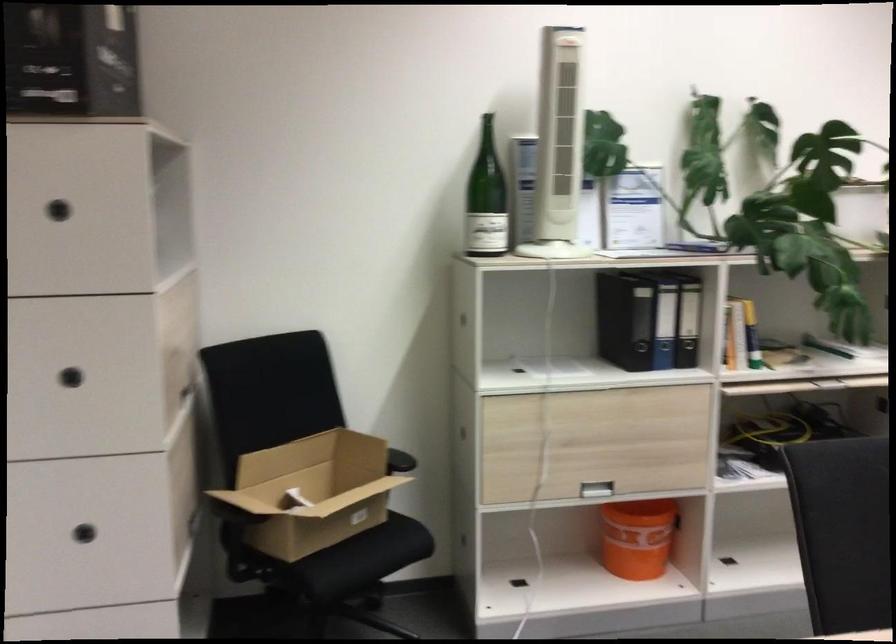
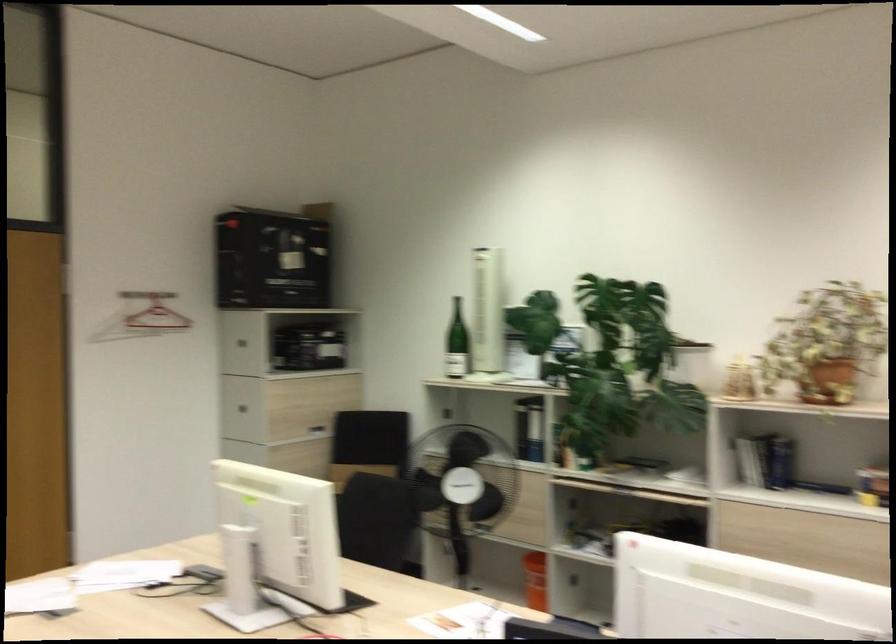
Question: I am providing you with two images of the same scene from different viewpoints. Which of the following objects are not visible in image2?

Choices:
 (A) stack of red books
 (B) dark drawer handle
 (C) chair sitting surface
 (D) green wine bottle

Answer: (B)